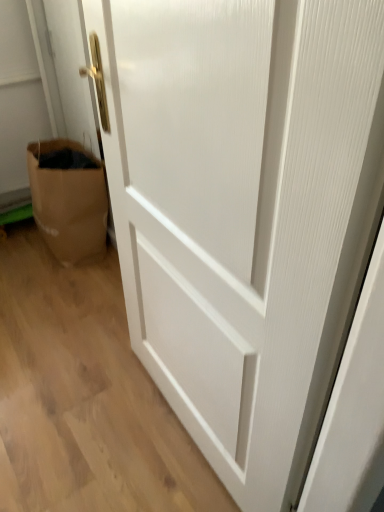
Measure the distance between brown paper bag at lower left and camera.

brown paper bag at lower left is 1.86 meters from camera.

I want to click on brown paper bag at lower left, so click(68, 198).

What is the approximate width of brown paper bag at lower left?

The width of brown paper bag at lower left is 13.34 inches.

What do you see at coordinates (68, 198) in the screenshot? Image resolution: width=384 pixels, height=512 pixels. I see `brown paper bag at lower left` at bounding box center [68, 198].

You are a GUI agent. You are given a task and a screenshot of the screen. Output one action in this format:
    pyautogui.click(x=<x>, y=<y>)
    Task: Click on the brown paper bag at lower left
    The height and width of the screenshot is (512, 384).
    Given the screenshot: What is the action you would take?
    pyautogui.click(x=68, y=198)